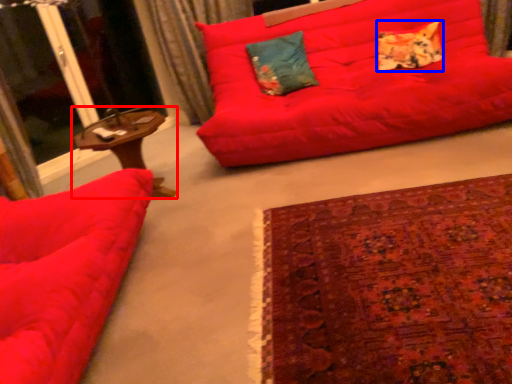
Question: Which point is closer to the camera, table (highlighted by a red box) or pillow (highlighted by a blue box)?

Choices:
 (A) table
 (B) pillow

Answer: (A)